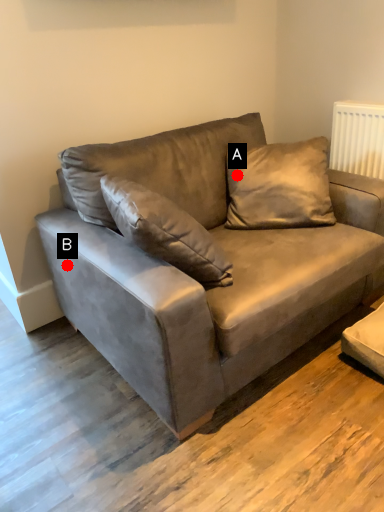
Question: Two points are circled on the image, labeled by A and B beside each circle. Which point is farther from the camera taking this photo?

Choices:
 (A) A is further
 (B) B is further

Answer: (A)